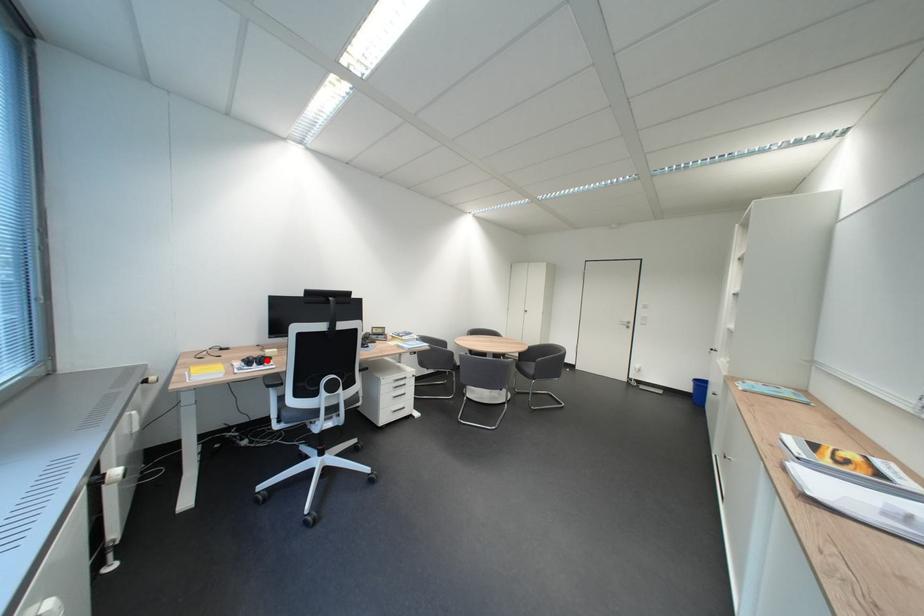
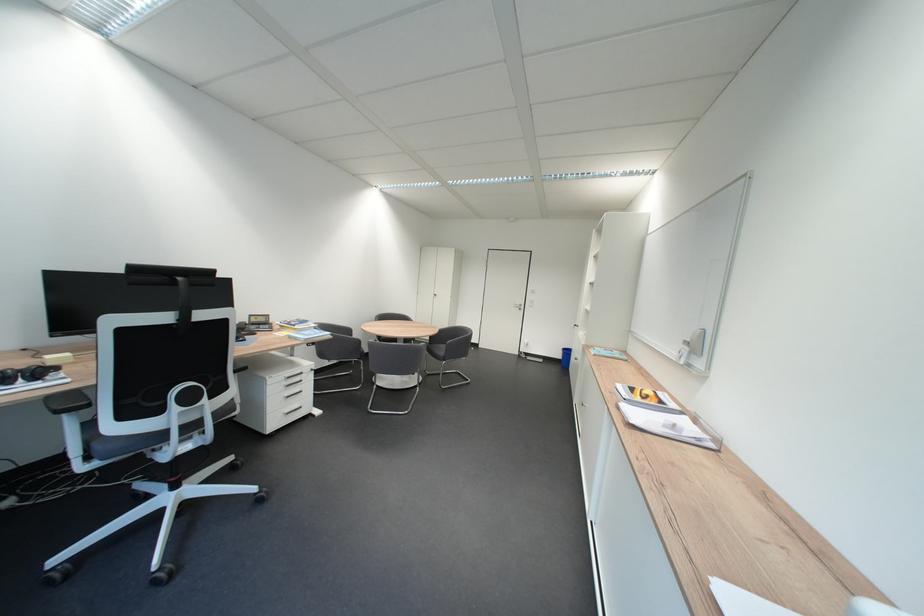
In the second image, find the point that corresponds to the highlighted location in the first image.

(32, 373)